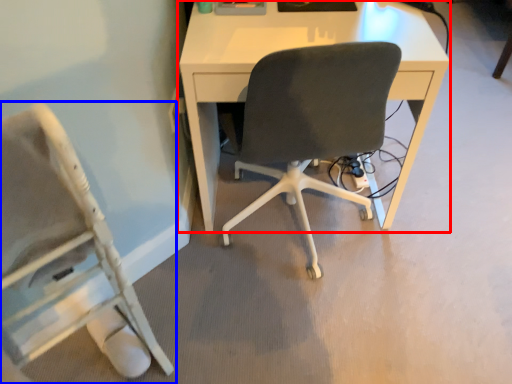
Question: Among these objects, which one is nearest to the camera, desk (highlighted by a red box) or chair (highlighted by a blue box)?

Choices:
 (A) desk
 (B) chair

Answer: (B)